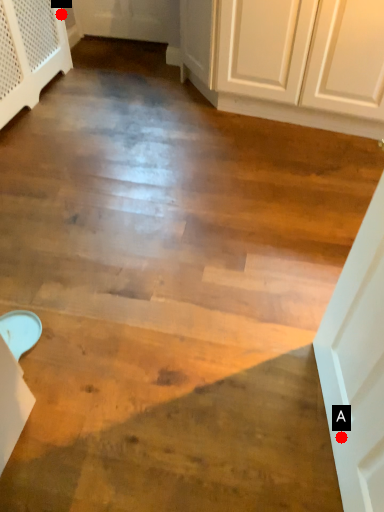
Question: Two points are circled on the image, labeled by A and B beside each circle. Which point is farther to the camera?

Choices:
 (A) A is further
 (B) B is further

Answer: (B)